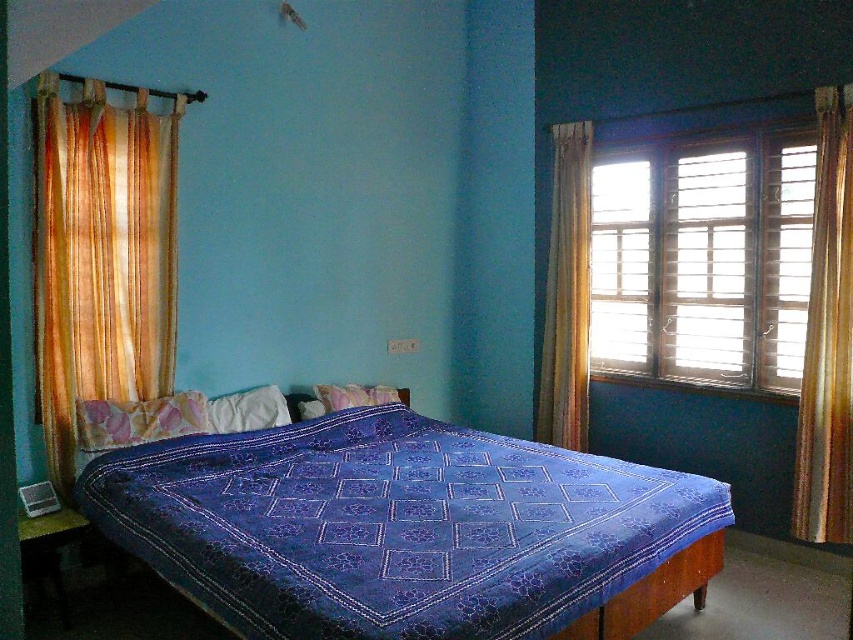
You are a delivery robot with a package that measures 60 centimeters in length. You need to navigate through the space between the orange sheer curtain at left and the white soft pillow at center. Can your package fit through this space without bending?

The distance between the orange sheer curtain at left and the white soft pillow at center is 62.12 centimeters. Since the package is 60 centimeters long, it can fit through the space without bending.